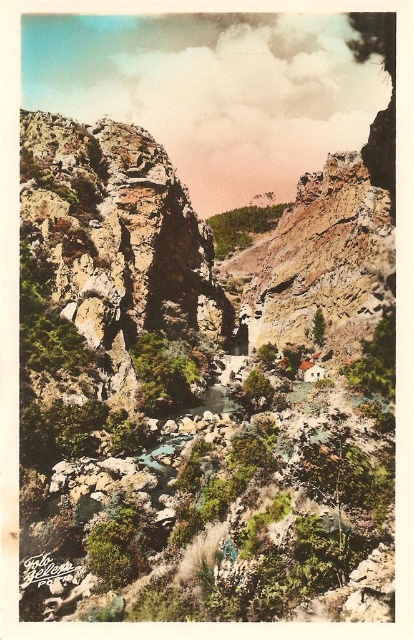
Question: Can you confirm if green leafy shrubs at center is thinner than green leafy trees at center?

Choices:
 (A) no
 (B) yes

Answer: (B)

Question: Can you confirm if green leafy shrubs at center is wider than green leafy trees at center?

Choices:
 (A) no
 (B) yes

Answer: (A)

Question: Can you confirm if green leafy shrubs at center is smaller than green leafy trees at center?

Choices:
 (A) yes
 (B) no

Answer: (A)